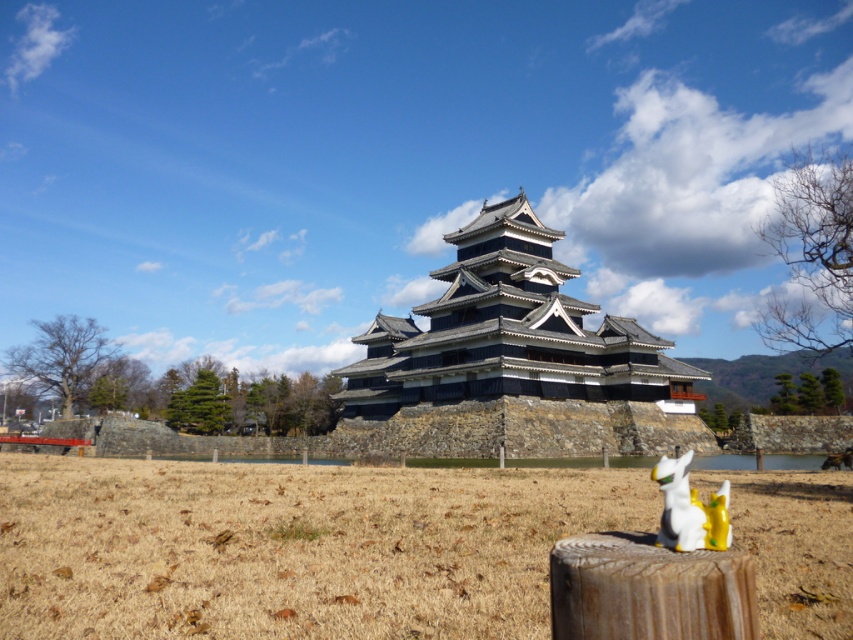
Question: Which object appears closest to the camera in this image?

Choices:
 (A) white glossy statue at lower right
 (B) brown grass at center
 (C) brown wood stump at lower center
 (D) dark gray stone fort at center

Answer: (C)

Question: Among these objects, which one is farthest from the camera?

Choices:
 (A) white glossy statue at lower right
 (B) brown grass at center
 (C) dark gray stone fort at center

Answer: (C)

Question: Can you confirm if dark gray stone fort at center is thinner than white glossy statue at lower right?

Choices:
 (A) yes
 (B) no

Answer: (B)

Question: Is brown wood stump at lower center bigger than white glossy statue at lower right?

Choices:
 (A) no
 (B) yes

Answer: (A)

Question: Is the position of brown grass at center less distant than that of dark gray stone fort at center?

Choices:
 (A) yes
 (B) no

Answer: (A)

Question: Estimate the real-world distances between objects in this image. Which object is closer to the dark gray stone fort at center?

Choices:
 (A) brown grass at center
 (B) brown wood stump at lower center

Answer: (A)